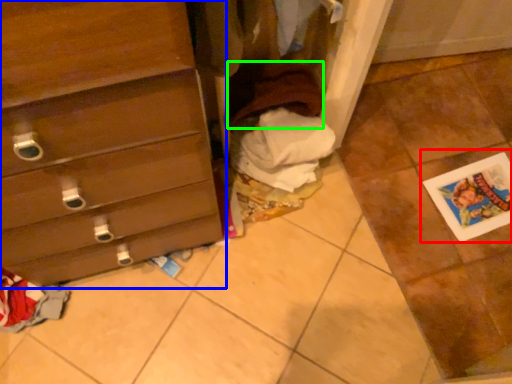
Question: Which is nearer to the postcard (highlighted by a red box)? chest of drawers (highlighted by a blue box) or clothing (highlighted by a green box).

Choices:
 (A) chest of drawers
 (B) clothing

Answer: (B)